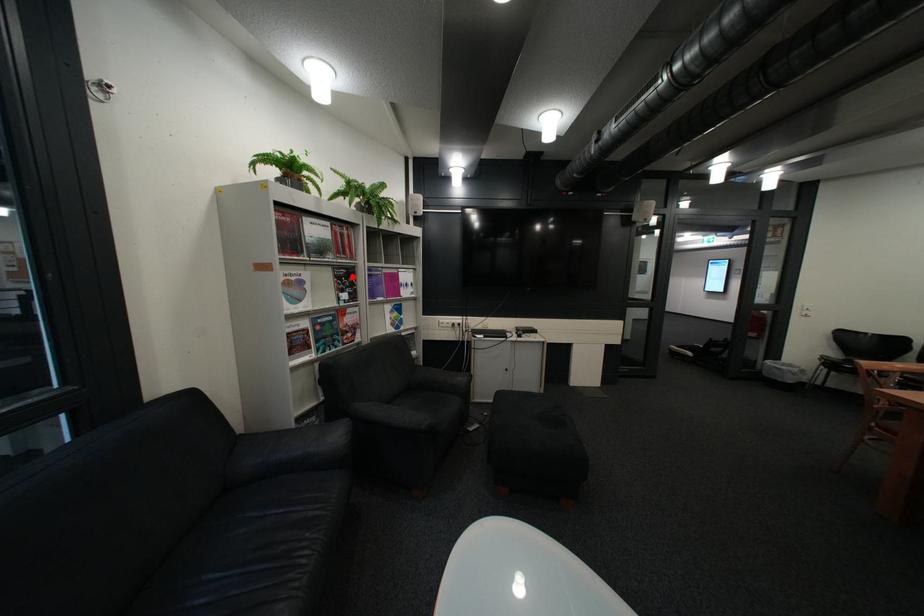
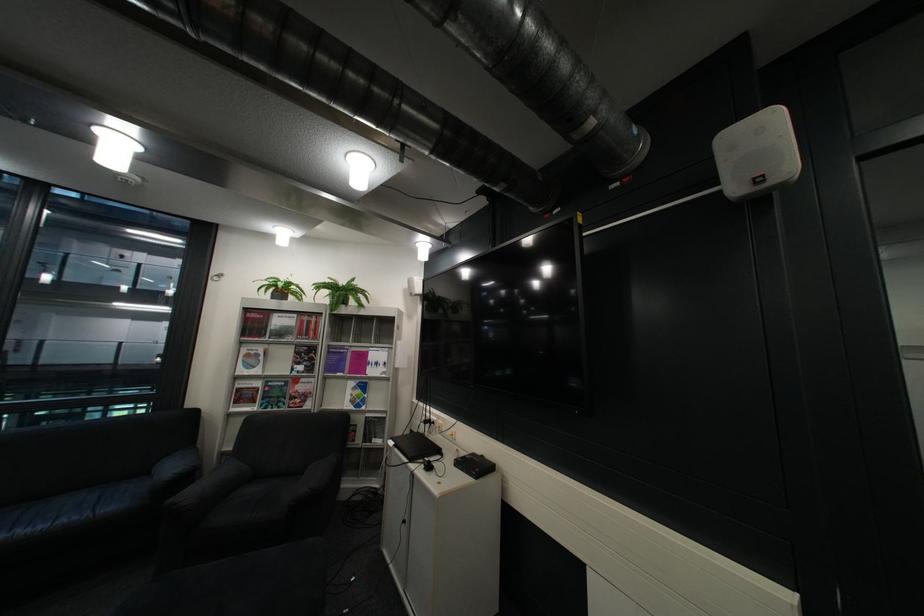
The point at the highlighted location is marked in the first image. Where is the corresponding point in the second image?

(311, 353)